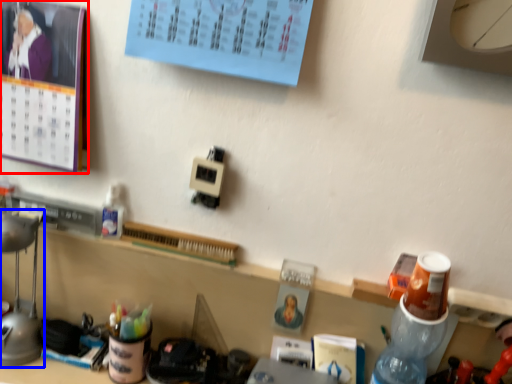
Question: Which object is further to the camera taking this photo, bulletin board (highlighted by a red box) or lamp (highlighted by a blue box)?

Choices:
 (A) bulletin board
 (B) lamp

Answer: (B)